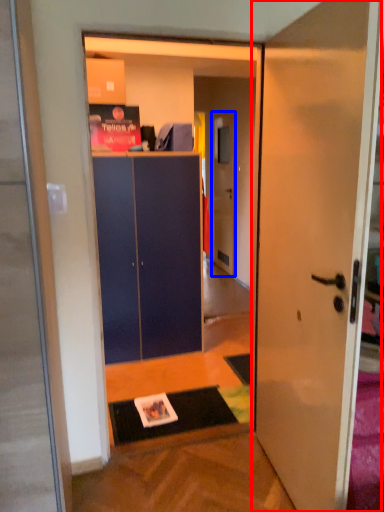
Question: Which object is further to the camera taking this photo, door (highlighted by a red box) or door (highlighted by a blue box)?

Choices:
 (A) door
 (B) door

Answer: (B)